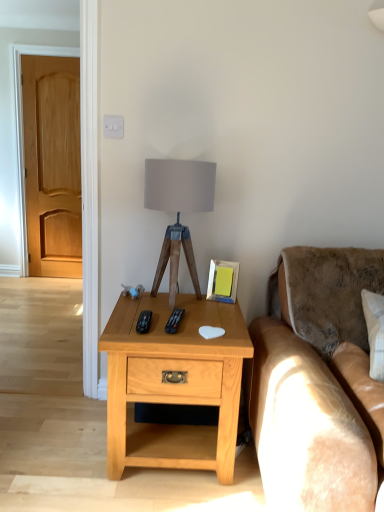
Question: Is black plastic remote at center, the 1th remote positioned from the right, facing away from light wood/texturedesk at center?

Choices:
 (A) no
 (B) yes

Answer: (A)

Question: Does black plastic remote at center, the 1th remote positioned from the right, have a larger size compared to light wood/texturedesk at center?

Choices:
 (A) yes
 (B) no

Answer: (B)

Question: Is light wood/texturedesk at center a part of black plastic remote at center, the 2th remote when ordered from left to right?

Choices:
 (A) yes
 (B) no

Answer: (B)

Question: Considering the relative sizes of black plastic remote at center, the 1th remote positioned from the right, and light wood/texturedesk at center in the image provided, is black plastic remote at center, the 1th remote positioned from the right, smaller than light wood/texturedesk at center?

Choices:
 (A) no
 (B) yes

Answer: (B)

Question: From the image's perspective, is black plastic remote at center, the 2th remote when ordered from left to right, under light wood/texturedesk at center?

Choices:
 (A) no
 (B) yes

Answer: (A)

Question: Looking at the image, does light brown wood door at left seem bigger or smaller compared to metallic silver picture frame at upper right?

Choices:
 (A) big
 (B) small

Answer: (A)

Question: Is light brown wood door at left wider or thinner than metallic silver picture frame at upper right?

Choices:
 (A) wide
 (B) thin

Answer: (A)

Question: Considering their positions, is light brown wood door at left located in front of or behind metallic silver picture frame at upper right?

Choices:
 (A) front
 (B) behind

Answer: (B)

Question: From a real-world perspective, is light brown wood door at left above or below metallic silver picture frame at upper right?

Choices:
 (A) above
 (B) below

Answer: (A)

Question: Is light brown wood door at left in front of or behind brown plush couch at right in the image?

Choices:
 (A) behind
 (B) front

Answer: (A)

Question: In the image, is light brown wood door at left on the left side or the right side of brown plush couch at right?

Choices:
 (A) left
 (B) right

Answer: (A)

Question: Considering the positions of light brown wood door at left and brown plush couch at right in the image, is light brown wood door at left taller or shorter than brown plush couch at right?

Choices:
 (A) short
 (B) tall

Answer: (B)

Question: Do you think light brown wood door at left is within brown plush couch at right, or outside of it?

Choices:
 (A) outside
 (B) inside

Answer: (A)

Question: Based on their sizes in the image, would you say metallic silver picture frame at upper right is bigger or smaller than black plastic remote at center, the 1th remote viewed from the left?

Choices:
 (A) big
 (B) small

Answer: (A)

Question: Considering the relative positions of metallic silver picture frame at upper right and black plastic remote at center, the 2th remote viewed from the right, in the image provided, is metallic silver picture frame at upper right to the left or to the right of black plastic remote at center, the 2th remote viewed from the right,?

Choices:
 (A) left
 (B) right

Answer: (B)